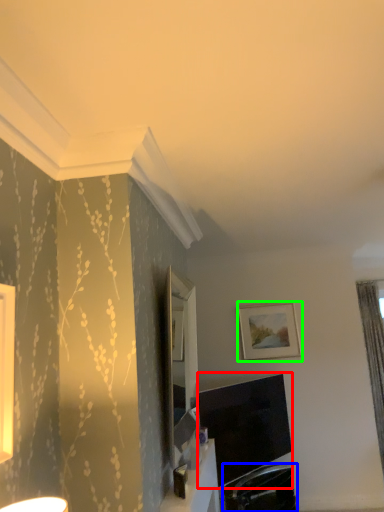
Question: Which object is the farthest from television (highlighted by a red box)? Choose among these: swivel chair (highlighted by a blue box) or picture frame (highlighted by a green box).

Choices:
 (A) swivel chair
 (B) picture frame

Answer: (B)